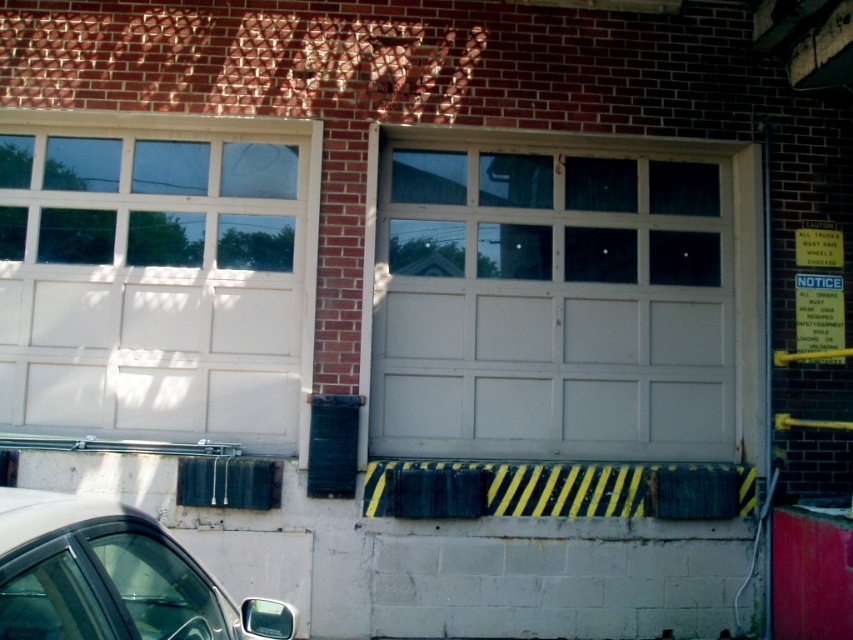
You are a delivery driver approaching the building and need to park your truck. There is a shiny silver car at lower left and a metallic red barrier at lower right. Which object is closer to you as you arrive?

The shiny silver car at lower left is closer to the viewer than the metallic red barrier at lower right, so the shiny silver car at lower left is closer to you as you arrive.

You are a delivery driver who needs to enter the building through the white painted wood door at center. However, there is a metallic red barrier at lower right in your way. Based on their positions, can you walk around the barrier to reach the door?

The white painted wood door at center is to the left of the metallic red barrier at lower right, so you can walk around the barrier on its right side to reach the door.

You are a delivery person arriving at this building with a package. You need to enter through the white painted wood door at center. However, there is a metallic red barrier at lower right blocking your path. Can you walk around the barrier to reach the door?

The white painted wood door at center is taller than the metallic red barrier at lower right. Since the barrier is lower, you can walk around it to reach the door as long as there is space to navigate around the barrier.